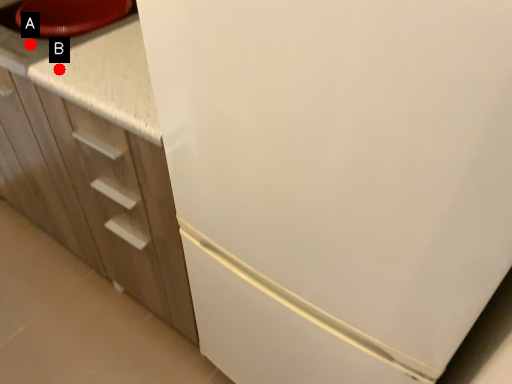
Question: Two points are circled on the image, labeled by A and B beside each circle. Which point is closer to the camera?

Choices:
 (A) A is closer
 (B) B is closer

Answer: (B)